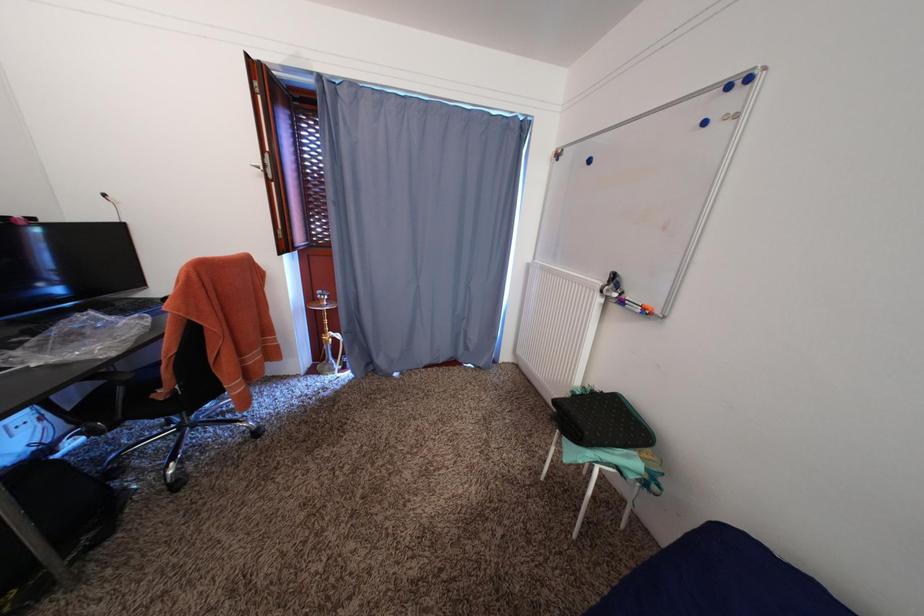
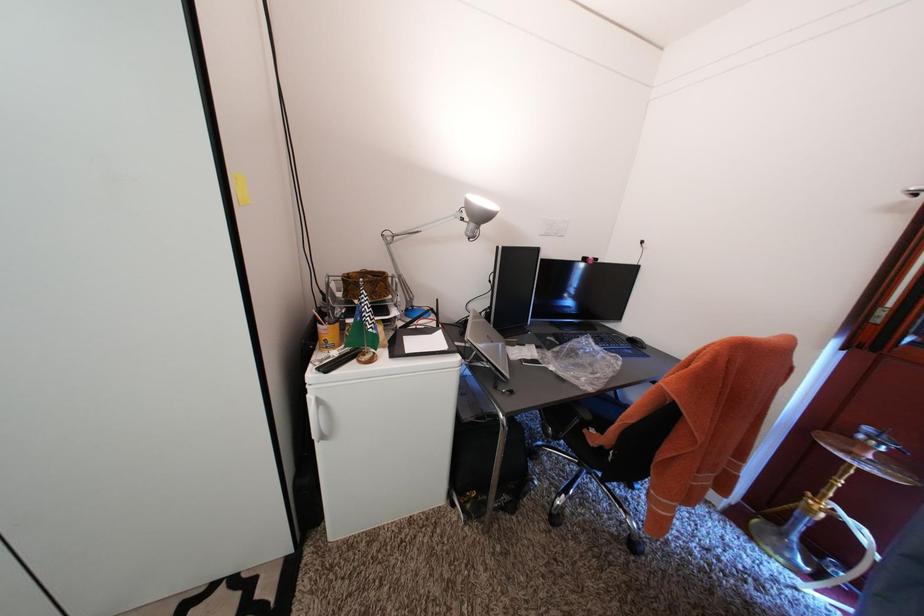
Question: The first image is from the beginning of the video and the second image is from the end. How did the camera likely rotate when shooting the video?

Choices:
 (A) Left
 (B) Right
 (C) Up
 (D) Down

Answer: (A)